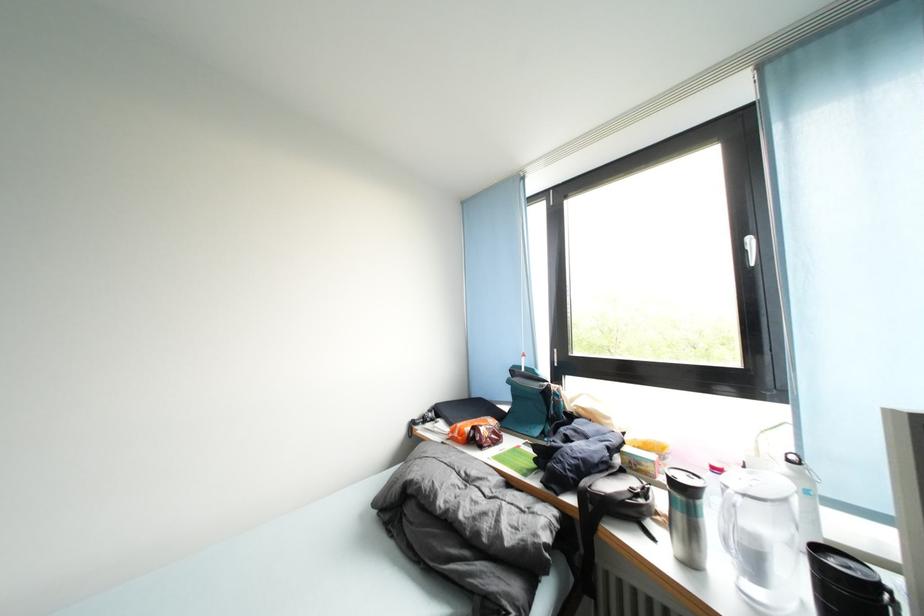
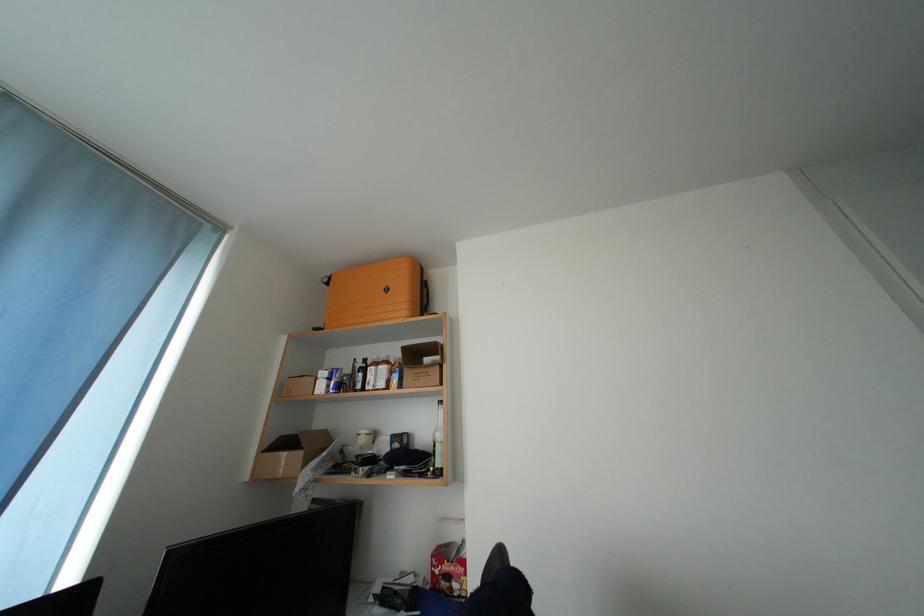
The first image is from the beginning of the video and the second image is from the end. How did the camera likely rotate when shooting the video?

The camera rotated toward right-up.